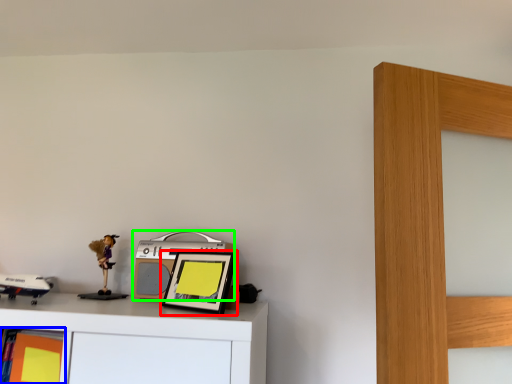
Question: Considering the real-world distances, which object is farthest from picture frame (highlighted by a red box)? shelf (highlighted by a blue box) or stereo (highlighted by a green box)?

Choices:
 (A) shelf
 (B) stereo

Answer: (A)